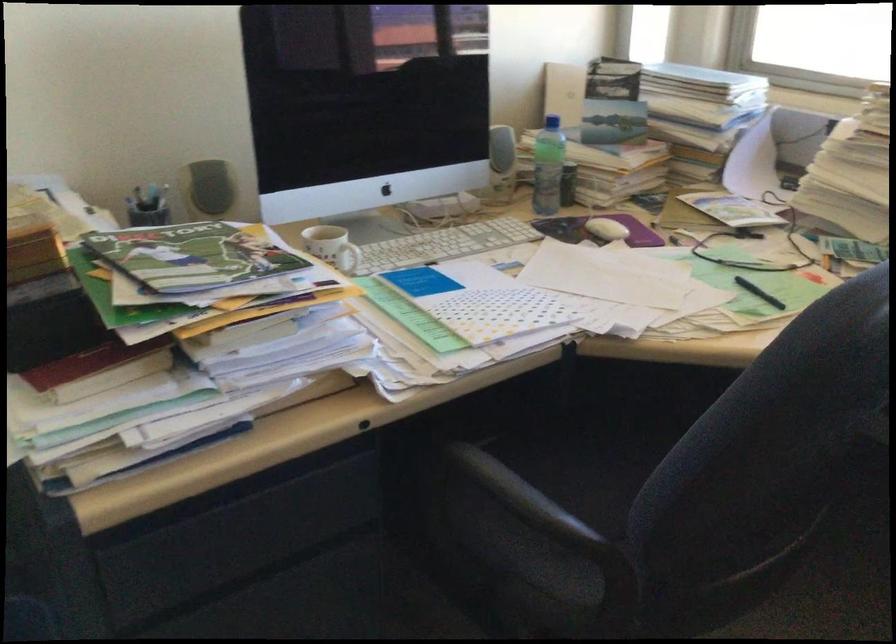
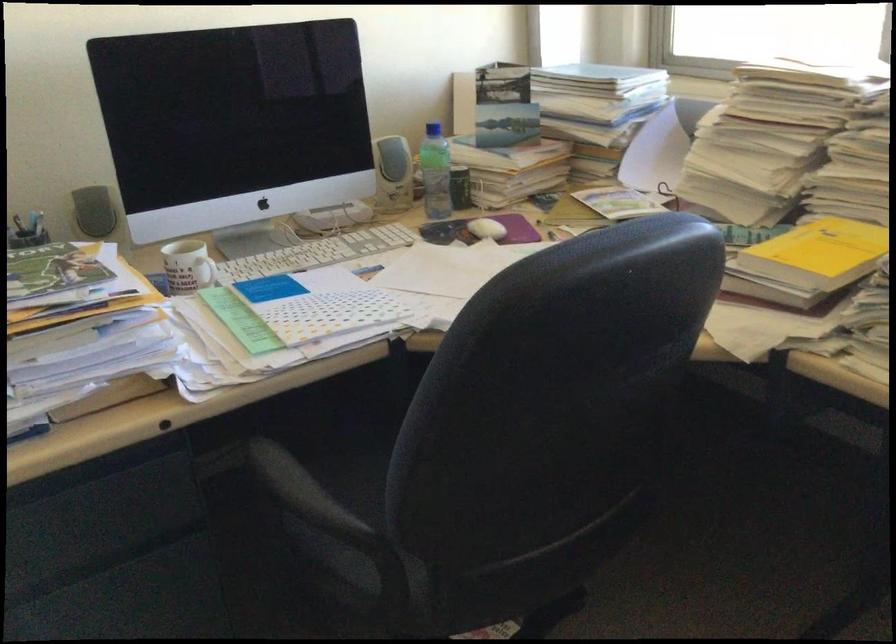
The point at (217, 185) is marked in the first image. Where is the corresponding point in the second image?

(93, 211)